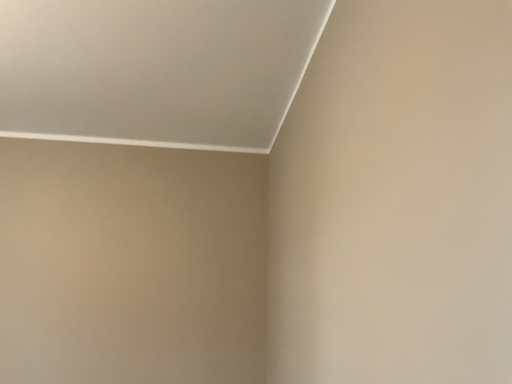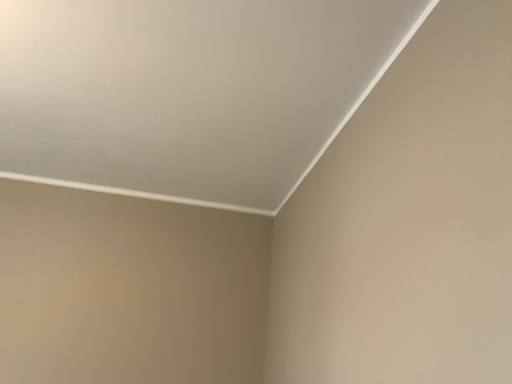
Question: How did the camera likely rotate when shooting the video?

Choices:
 (A) rotated upward
 (B) rotated downward

Answer: (A)